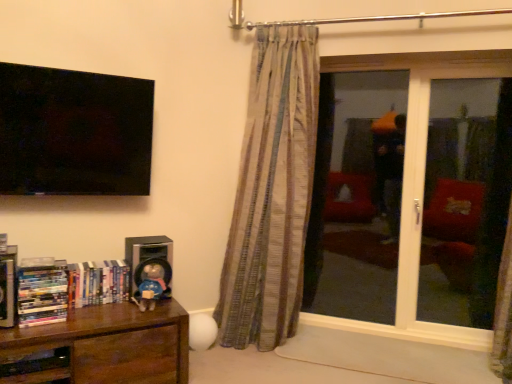
Question: Is hardcover book at left, positioned as the first book in left-to-right order, thinner than transparent glass door at right?

Choices:
 (A) yes
 (B) no

Answer: (B)

Question: Is hardcover book at left, positioned as the first book in left-to-right order, at the right side of transparent glass door at right?

Choices:
 (A) yes
 (B) no

Answer: (B)

Question: Is hardcover book at left, the 3th book viewed from the right, facing away from transparent glass door at right?

Choices:
 (A) no
 (B) yes

Answer: (A)

Question: Is transparent glass door at right inside hardcover book at left, the 3th book viewed from the right?

Choices:
 (A) no
 (B) yes

Answer: (A)

Question: Is hardcover book at left, the 3th book viewed from the right, shorter than transparent glass door at right?

Choices:
 (A) yes
 (B) no

Answer: (A)

Question: Does hardcover book at left, positioned as the first book in left-to-right order, have a greater width compared to transparent glass door at right?

Choices:
 (A) yes
 (B) no

Answer: (A)

Question: Could you tell me if transparent glass door at right is facing satin black speaker at lower left?

Choices:
 (A) no
 (B) yes

Answer: (A)

Question: Considering the relative sizes of transparent glass door at right and satin black speaker at lower left in the image provided, is transparent glass door at right wider than satin black speaker at lower left?

Choices:
 (A) yes
 (B) no

Answer: (B)

Question: Is transparent glass door at right positioned beyond the bounds of satin black speaker at lower left?

Choices:
 (A) no
 (B) yes

Answer: (B)

Question: Does transparent glass door at right have a larger size compared to satin black speaker at lower left?

Choices:
 (A) no
 (B) yes

Answer: (B)

Question: Can you confirm if transparent glass door at right is smaller than satin black speaker at lower left?

Choices:
 (A) no
 (B) yes

Answer: (A)

Question: Can you see transparent glass door at right touching satin black speaker at lower left?

Choices:
 (A) yes
 (B) no

Answer: (B)

Question: Considering the relative positions of brown wood bookcase at lower left and hardcover books at left, the 1th book viewed from the right, in the image provided, is brown wood bookcase at lower left to the left of hardcover books at left, the 1th book viewed from the right, from the viewer's perspective?

Choices:
 (A) yes
 (B) no

Answer: (B)